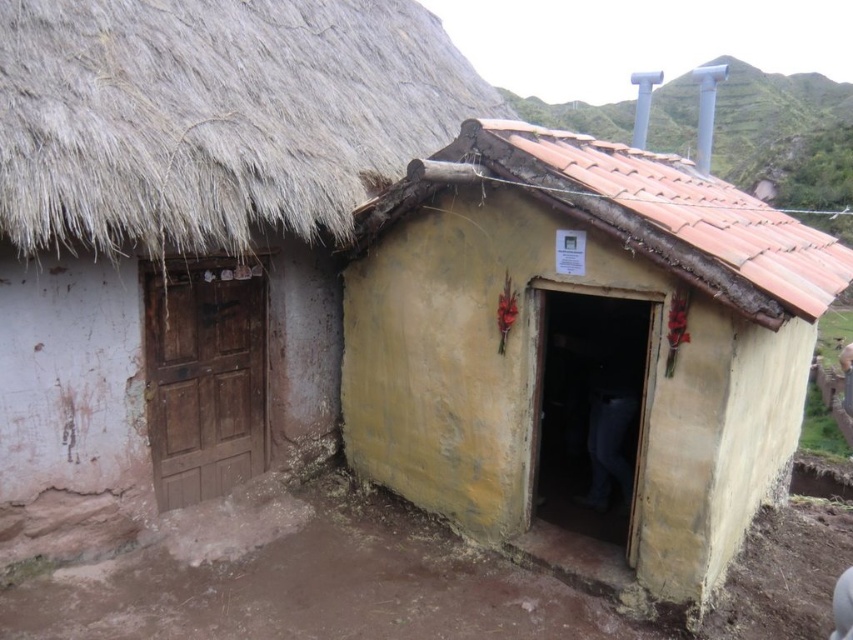
You are standing in front of the building and want to place a new sign on the part of the roof that is farther away. Which roof section should you choose between the thatched straw roof at upper left and the terracotta tiled roof at center?

The terracotta tiled roof at center is farther away from the viewer than the thatched straw roof at upper left, so you should place the sign on the terracotta tiled roof at center.

You are standing at point A located at point (410, 349). You want to walk to point B, which is 17.29 feet away. The path between them is clear except for a small mud puddle that is 3 feet wide. Can you walk around the puddle without deviating more than 2 feet from your original path?

The distance between point A and point B is 17.29 feet. The mud puddle is 3 feet wide. To walk around it without deviating more than 2 feet from the original path, you would need to go around either side of the puddle. However, since the maximum allowed deviation is 2 feet and the puddle is 3 feet wide, you cannot walk around it within the 2 feet deviation limit. Therefore, you would need to find an alternative path or avoid the puddle entirely.

You are a construction worker tasked with placing a 6 feet long wooden beam between the yellow mud hut at center and the brown clay mud at lower center. Can the beam fit between them without bending or breaking?

The yellow mud hut at center is 6.33 feet from the brown clay mud at lower center. Since the beam is 6 feet long, it can fit between them without bending or breaking as the distance is slightly longer than the beam.